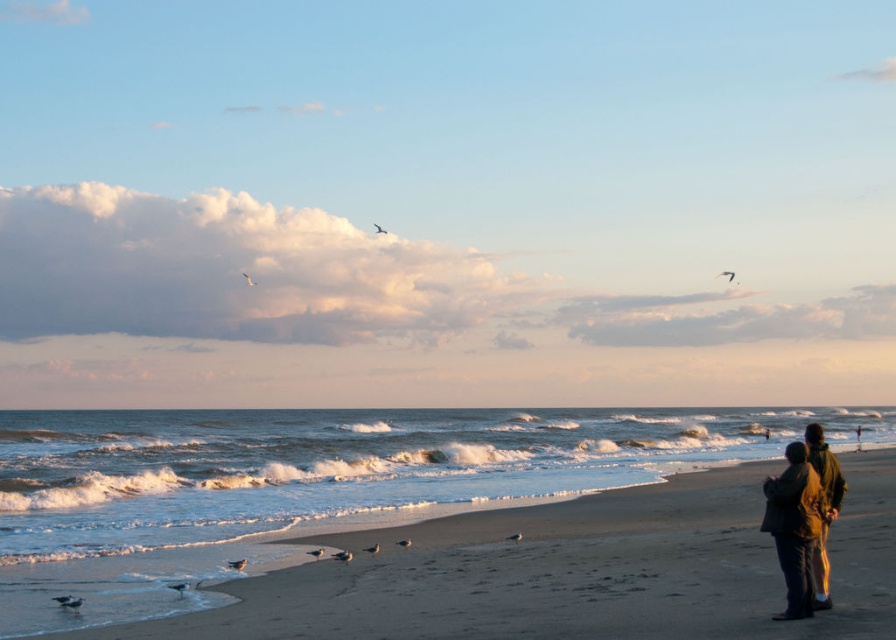
You are standing at the beach and want to reach the point marked as point (795, 584). If you walk straight towards it, how far will you have to walk?

You will have to walk 13.44 meters to reach point (795, 584) because the distance between you and the point is 13.44 meters.

You are standing on the sandy beach at lower right and want to place your green woolen jacket at lower right on the sand. Based on the scene description, will the jacket fit entirely on the sandy beach area without overlapping the edge?

The sandy beach at lower right is wider than the green woolen jacket at lower right, so yes, the jacket will fit entirely on the sandy beach area without overlapping the edge.